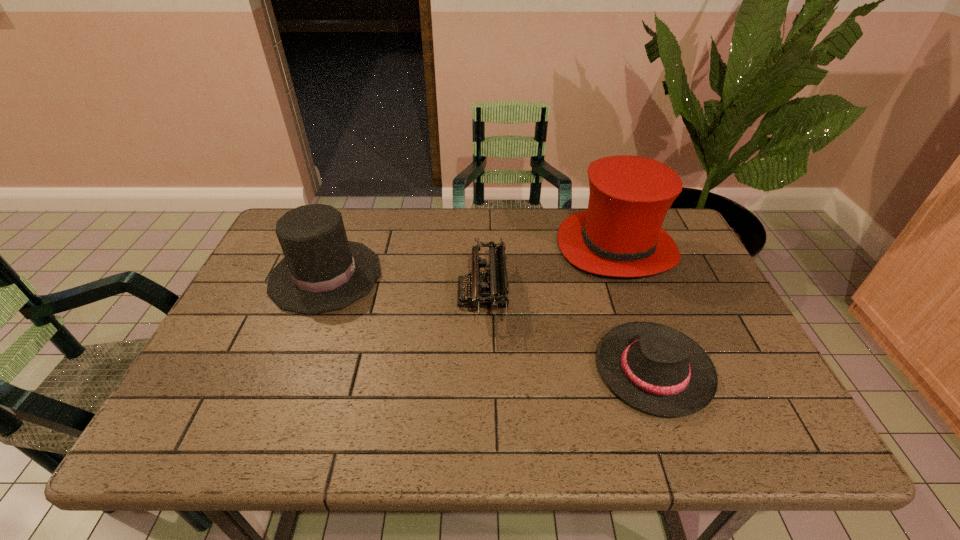
Where is `vacant region at the near left corner of the desktop`? Image resolution: width=960 pixels, height=540 pixels. vacant region at the near left corner of the desktop is located at coordinates (212, 442).

Locate an element on the screen. vacant space that is in between the shortest dress hat and the typewriter is located at coordinates (568, 332).

At what (x,y) coordinates should I click in order to perform the action: click on free space between the tallest object and the shortest dress hat. Please return your answer as a coordinate pair (x, y). This screenshot has width=960, height=540. Looking at the image, I should click on (635, 308).

Where is `vacant space that is in between the tallest dress hat and the third shortest object`? vacant space that is in between the tallest dress hat and the third shortest object is located at coordinates (470, 261).

Where is `free spot between the typewriter and the shortest dress hat`? This screenshot has width=960, height=540. free spot between the typewriter and the shortest dress hat is located at coordinates (568, 332).

The width and height of the screenshot is (960, 540). I want to click on free spot between the second object from left to right and the leftmost object, so click(x=404, y=285).

In order to click on vacant space that is in between the shortest dress hat and the tallest object in this screenshot , I will do `click(635, 308)`.

Locate an element on the screen. This screenshot has width=960, height=540. empty location between the second object from left to right and the nearest dress hat is located at coordinates (568, 332).

Where is `vacant space that's between the leftmost dress hat and the tallest dress hat`? This screenshot has height=540, width=960. vacant space that's between the leftmost dress hat and the tallest dress hat is located at coordinates point(470,261).

The height and width of the screenshot is (540, 960). What are the coordinates of `vacant space that is in between the second tallest object and the nearest dress hat` in the screenshot? It's located at (490, 323).